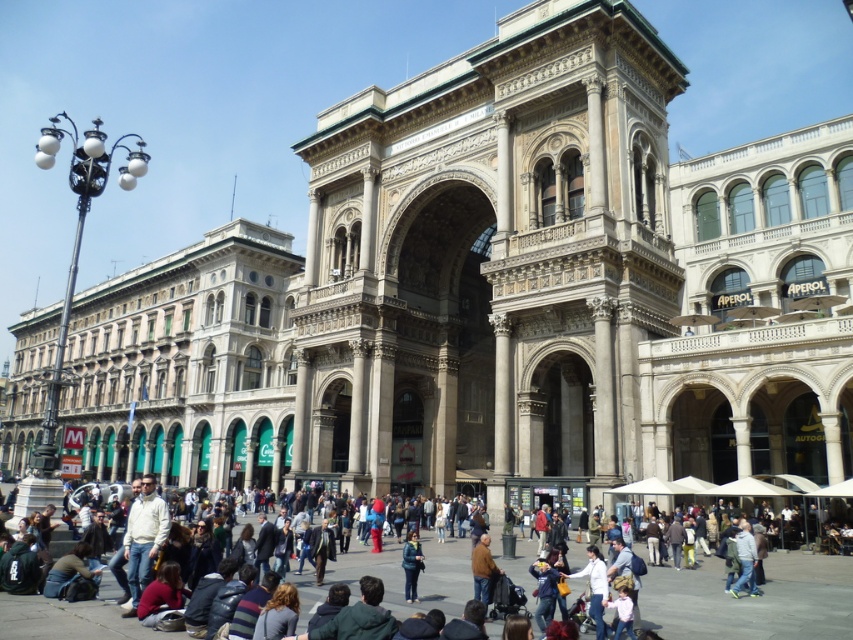
Question: Can you confirm if blue denim jacket at center is bigger than dark blue denim jacket at center?

Choices:
 (A) no
 (B) yes

Answer: (B)

Question: Which is farther from the white matte jacket at lower left?

Choices:
 (A) dark blue denim jacket at center
 (B) blue denim jacket at center

Answer: (B)

Question: Estimate the real-world distances between objects in this image. Which object is farther from the blue denim jacket at center?

Choices:
 (A) dark blue denim jacket at center
 (B) white matte jacket at lower left

Answer: (B)

Question: Can you confirm if white matte jacket at lower left is positioned to the right of dark blue denim jacket at center?

Choices:
 (A) no
 (B) yes

Answer: (A)

Question: In this image, where is blue denim jacket at center located relative to white matte jacket at lower left?

Choices:
 (A) above
 (B) below

Answer: (A)

Question: Among these objects, which one is farthest from the camera?

Choices:
 (A) dark blue denim jacket at center
 (B) white matte jacket at lower left

Answer: (A)